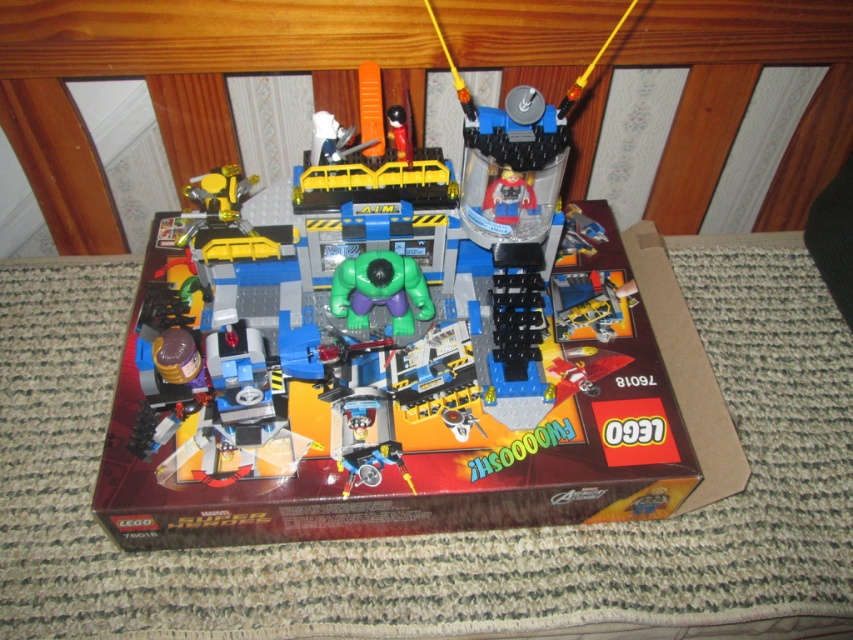
Question: Does brown cardboard box at center have a smaller size compared to green rubber toy at center?

Choices:
 (A) no
 (B) yes

Answer: (A)

Question: Does brown cardboard box at center appear over green rubber toy at center?

Choices:
 (A) yes
 (B) no

Answer: (B)

Question: Can you confirm if brown cardboard box at center is positioned below green rubber toy at center?

Choices:
 (A) yes
 (B) no

Answer: (A)

Question: Among these objects, which one is nearest to the camera?

Choices:
 (A) green rubber toy at center
 (B) brown cardboard box at center

Answer: (B)